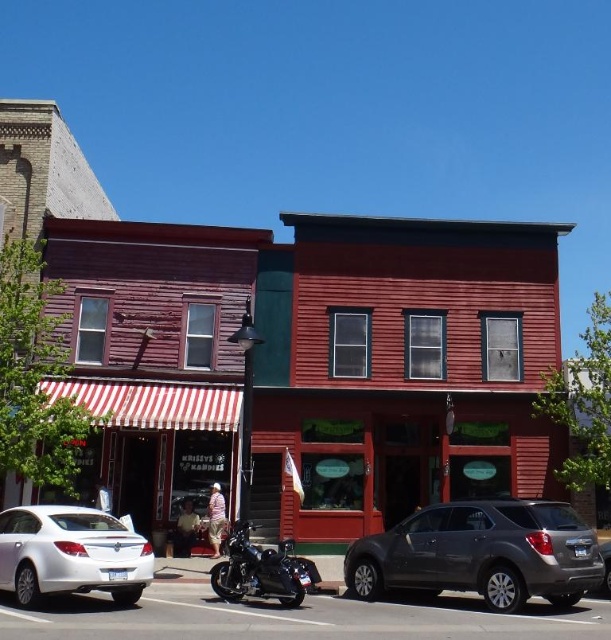
You are a delivery person who needs to park your vehicle in this street scene. You have a delivery truck that is 1.8 meters tall. Can you safely park your truck between the matte gray suv at lower right and the white glossy sedan at lower left without hitting the awning of the red building?

The matte gray suv at lower right is taller than the white glossy sedan at lower left. Since your delivery truck is 1.8 meters tall, you need to compare its height with the shorter vehicle. The white glossy sedan at lower left is shorter, so if the space between them allows, parking near the white glossy sedan at lower left might be safer. However, the exact clearance under the awning isn

You are a delivery person who needs to park your vehicle between the matte gray suv at lower right and the white glossy sedan at lower left. Your vehicle is 1.8 meters wide. Can you fit your car in the available space between them?

The matte gray suv at lower right is wider than the white glossy sedan at lower left. Since the available space between them depends on their widths, but the exact distance isn